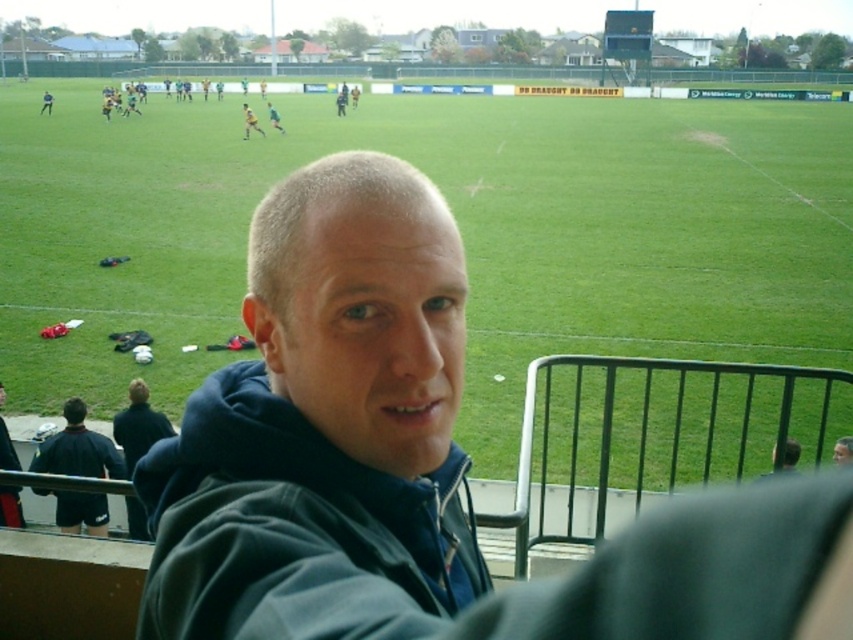
Question: From the image, what is the correct spatial relationship of dark blue hoodie at lower left in relation to green jersey at center?

Choices:
 (A) below
 (B) above

Answer: (A)

Question: Does black fleece jacket at lower left appear on the right side of smooth gray hoodie at center?

Choices:
 (A) no
 (B) yes

Answer: (A)

Question: Based on their relative distances, which object is farther from the dark brown hair at lower right?

Choices:
 (A) matte black jacket at upper center
 (B) black fleece jacket at lower left
 (C) smooth gray hoodie at center
 (D) dark blue hoodie at lower left

Answer: (A)

Question: Which of the following is the closest to the observer?

Choices:
 (A) matte black jacket at upper center
 (B) green jersey at center

Answer: (B)

Question: Among these points, which one is farthest from the camera?

Choices:
 (A) (3, 493)
 (B) (109, 454)

Answer: (B)

Question: Does green grass football field at center come behind dark brown hair at lower right?

Choices:
 (A) no
 (B) yes

Answer: (B)